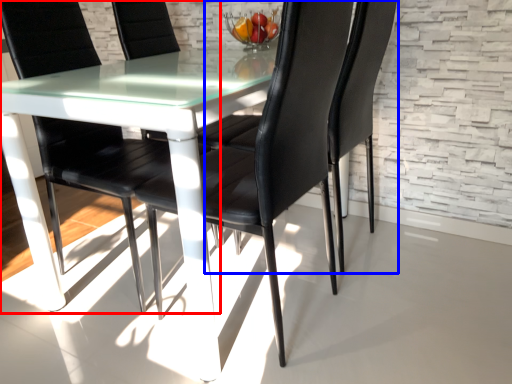
Question: Which point is further to the camera, chair (highlighted by a red box) or chair (highlighted by a blue box)?

Choices:
 (A) chair
 (B) chair

Answer: (B)